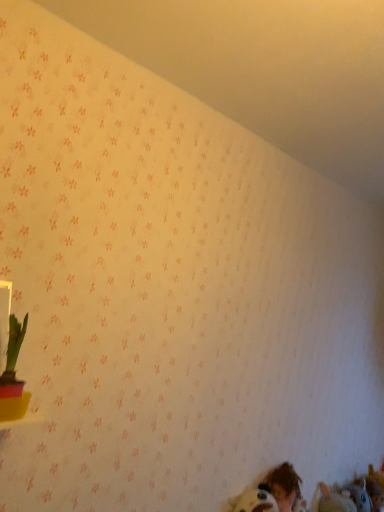
Question: Considering the positions of point [283, 463] and point [321, 494], is point [283, 463] closer or farther from the camera than point [321, 494]?

Choices:
 (A) farther
 (B) closer

Answer: (B)

Question: Is brown hair at lower right bigger or smaller than fuzzy brown stuffed toy at lower right, the 1th animal when ordered from left to right?

Choices:
 (A) big
 (B) small

Answer: (A)

Question: Which object is positioned closest to the green leafy plant in pink pot at left?

Choices:
 (A) brown hair at lower right
 (B) brown plush toy at lower right, which is the second animal in front-to-back order
 (C) fuzzy brown stuffed toy at lower right, which is the 1th animal in front-to-back order

Answer: (A)

Question: Which object is the farthest from the fuzzy brown stuffed toy at lower right, which is the 1th animal in front-to-back order?

Choices:
 (A) green leafy plant in pink pot at left
 (B) brown plush toy at lower right, which appears as the first animal when viewed from the right
 (C) brown hair at lower right

Answer: (A)